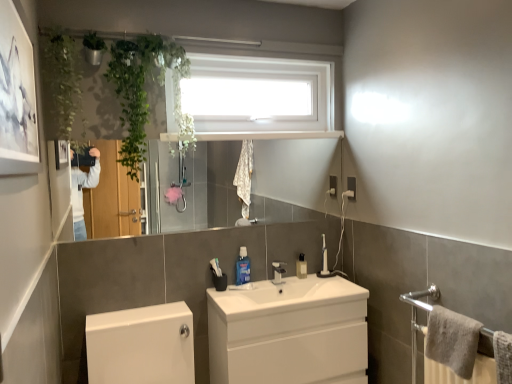
Identify the location of unoccupied region to the right of white plastic tap at center. [x=292, y=276].